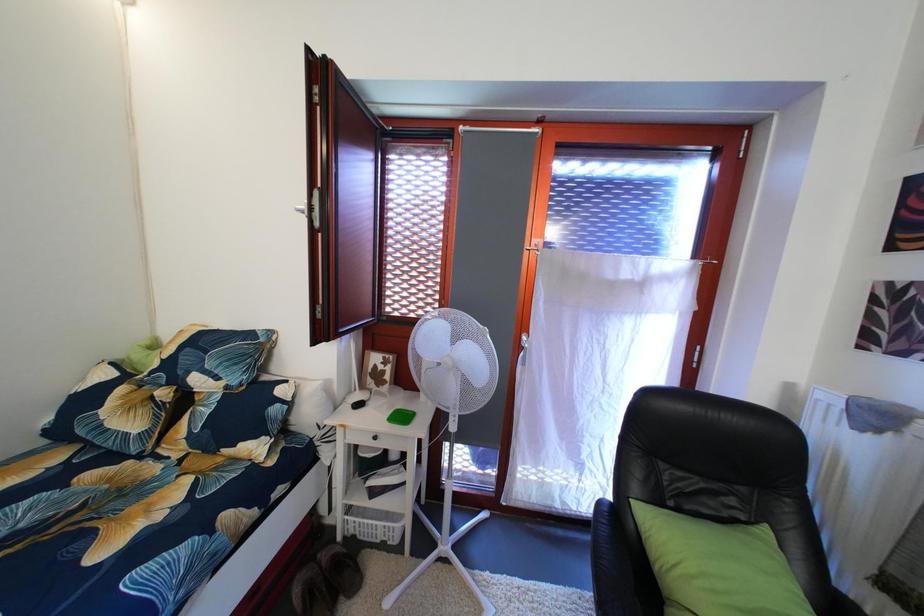
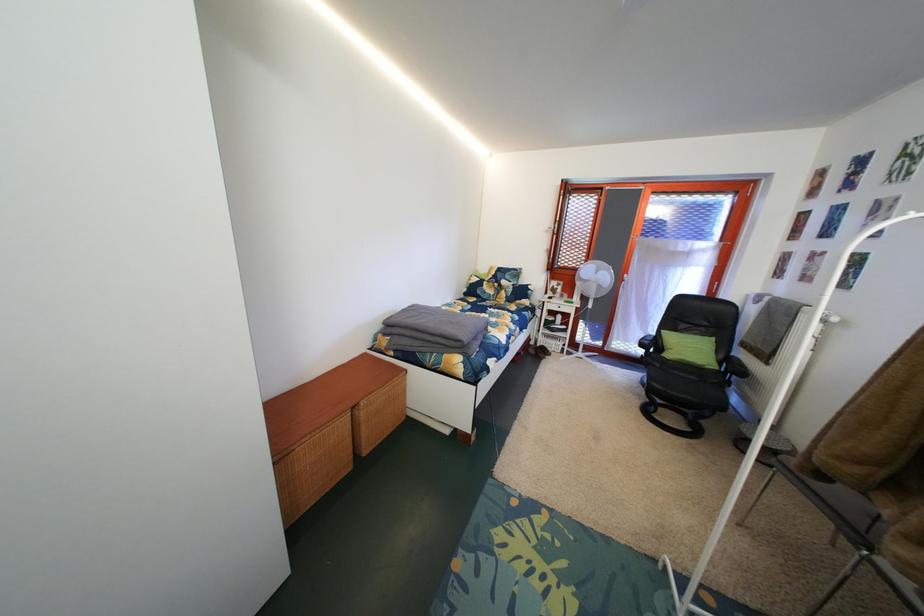
Question: Which direction would the cameraman need to move to produce the second image? Reply with the corresponding letter.

Choices:
 (A) Left
 (B) Right
 (C) Forward
 (D) Backward

Answer: (D)